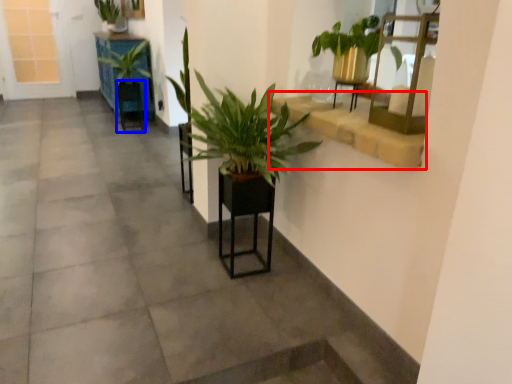
Question: Which point is further to the camera, window sill (highlighted by a red box) or armchair (highlighted by a blue box)?

Choices:
 (A) window sill
 (B) armchair

Answer: (B)